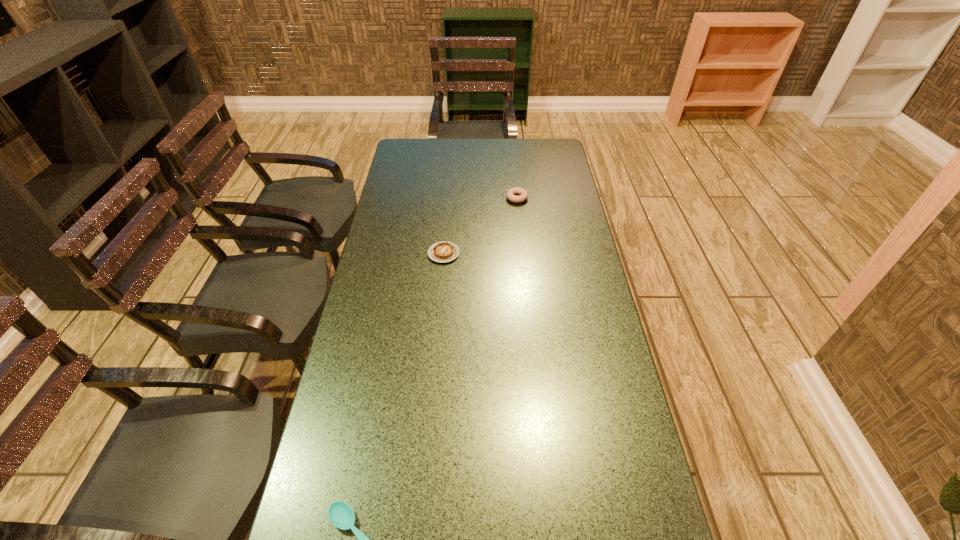
I want to click on object that is the second closest one to the rightmost object, so click(341, 515).

Identify which object is the second closest to the rightmost object. Please provide its 2D coordinates. Your answer should be formatted as a tuple, i.e. [(x, y)], where the tuple contains the x and y coordinates of a point satisfying the conditions above.

[(341, 515)]